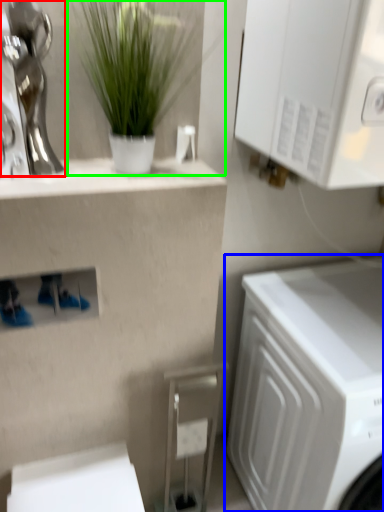
Question: Which is farther away from statue (highlighted by a red box)? washing machine (highlighted by a blue box) or houseplant (highlighted by a green box)?

Choices:
 (A) washing machine
 (B) houseplant

Answer: (A)